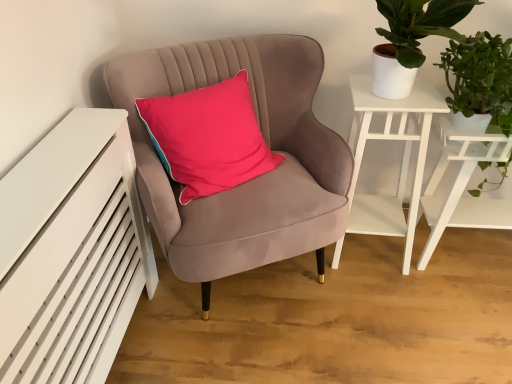
Question: Would you say velvet pink chair at center is to the left or to the right of white matte table at right in the picture?

Choices:
 (A) left
 (B) right

Answer: (A)

Question: Considering their positions, is velvet pink chair at center located in front of or behind white matte table at right?

Choices:
 (A) front
 (B) behind

Answer: (A)

Question: Estimate the real-world distances between objects in this image. Which object is farther from the white matte side table at upper right?

Choices:
 (A) velvet pink chair at center
 (B) white matte table at right
 (C) green leafy plant at upper right

Answer: (A)

Question: Based on their relative distances, which object is nearer to the white matte table at right?

Choices:
 (A) velvet pink chair at center
 (B) green leafy plant at upper right
 (C) white matte side table at upper right

Answer: (C)